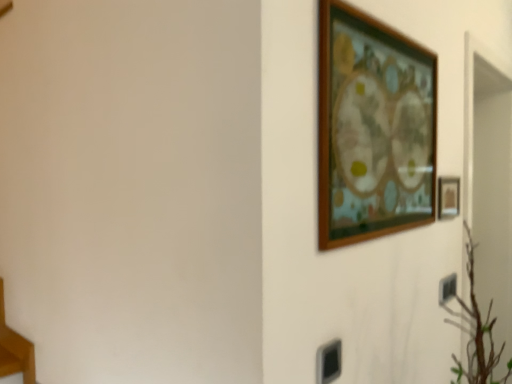
Question: Should I look upward or downward to see wooden table at lower left?

Choices:
 (A) down
 (B) up

Answer: (A)

Question: Considering the relative sizes of black plastic electric outlet at lower right and wooden table at lower left in the image provided, is black plastic electric outlet at lower right bigger than wooden table at lower left?

Choices:
 (A) yes
 (B) no

Answer: (B)

Question: Does black plastic electric outlet at lower right contain wooden table at lower left?

Choices:
 (A) yes
 (B) no

Answer: (B)

Question: From the image's perspective, is black plastic electric outlet at lower right beneath wooden table at lower left?

Choices:
 (A) no
 (B) yes

Answer: (A)

Question: Does black plastic electric outlet at lower right have a lesser height compared to wooden table at lower left?

Choices:
 (A) yes
 (B) no

Answer: (A)

Question: Is black plastic electric outlet at lower right at the right side of wooden table at lower left?

Choices:
 (A) no
 (B) yes

Answer: (B)

Question: Is black plastic electric outlet at lower right not inside wooden table at lower left?

Choices:
 (A) no
 (B) yes

Answer: (B)

Question: Is wooden picture frame at upper right, which is the second picture frame from back to front, turned away from wooden picture frame at right, placed as the 1th picture frame when sorted from back to front?

Choices:
 (A) yes
 (B) no

Answer: (B)

Question: Is wooden picture frame at upper right, the first picture frame when ordered from left to right, not inside wooden picture frame at right, placed as the 1th picture frame when sorted from back to front?

Choices:
 (A) no
 (B) yes

Answer: (B)

Question: From a real-world perspective, is wooden picture frame at upper right, which is the second picture frame from back to front, over wooden picture frame at right, placed as the 1th picture frame when sorted from back to front?

Choices:
 (A) yes
 (B) no

Answer: (A)

Question: Considering the relative positions of wooden picture frame at upper right, the 1th picture frame from the front, and wooden picture frame at right, marked as the second picture frame in a front-to-back arrangement, in the image provided, is wooden picture frame at upper right, the 1th picture frame from the front, behind wooden picture frame at right, marked as the second picture frame in a front-to-back arrangement,?

Choices:
 (A) no
 (B) yes

Answer: (A)

Question: Is the position of wooden picture frame at upper right, arranged as the second picture frame when viewed from the right, less distant than that of wooden picture frame at right, placed as the 1th picture frame when sorted from back to front?

Choices:
 (A) no
 (B) yes

Answer: (B)

Question: Is wooden picture frame at upper right, the 1th picture frame from the front, taller than wooden picture frame at right, placed as the 1th picture frame when sorted from back to front?

Choices:
 (A) no
 (B) yes

Answer: (B)

Question: Does wooden picture frame at right, which ranks as the 1th picture frame in right-to-left order, have a larger size compared to wooden table at lower left?

Choices:
 (A) no
 (B) yes

Answer: (A)